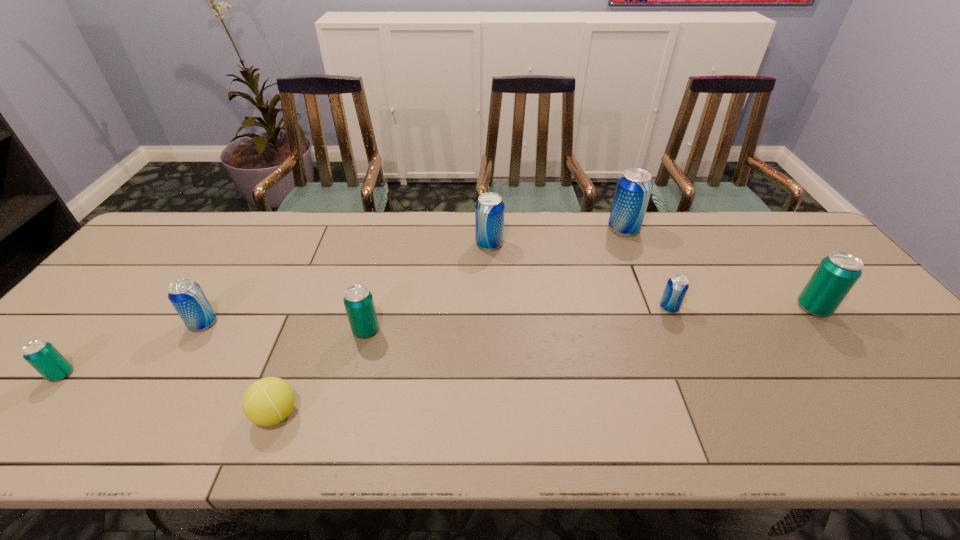
Where is `empty space that is in between the rightmost beer can and the sixth object from right to left`? empty space that is in between the rightmost beer can and the sixth object from right to left is located at coordinates (544, 361).

Locate an element on the screen. free space between the fourth object from right to left and the seventh object from right to left is located at coordinates (347, 284).

The width and height of the screenshot is (960, 540). I want to click on empty space that is in between the fourth object from left to right and the green tennis ball, so click(x=321, y=372).

Find the location of a particular element. This screenshot has height=540, width=960. vacant area that lies between the green tennis ball and the smallest blue beer can is located at coordinates (472, 361).

You are a GUI agent. You are given a task and a screenshot of the screen. Output one action in this format:
    pyautogui.click(x=<x>, y=<y>)
    Task: Click on the free spot between the leftmost beer can and the rightmost object
    The height and width of the screenshot is (540, 960).
    Given the screenshot: What is the action you would take?
    pyautogui.click(x=438, y=341)

Image resolution: width=960 pixels, height=540 pixels. Find the location of `free space between the tallest beer can and the second object from left to right`. free space between the tallest beer can and the second object from left to right is located at coordinates (413, 276).

Locate an element on the screen. The height and width of the screenshot is (540, 960). free space between the green tennis ball and the sixth beer can from right to left is located at coordinates tap(240, 369).

Locate an element on the screen. The height and width of the screenshot is (540, 960). free space between the smallest blue beer can and the third biggest blue beer can is located at coordinates (436, 315).

I want to click on object that is the sixth closest to the fifth beer can from right to left, so click(x=633, y=190).

Select which object appears as the fifth closest to the tennis ball. Please provide its 2D coordinates. Your answer should be formatted as a tuple, i.e. [(x, y)], where the tuple contains the x and y coordinates of a point satisfying the conditions above.

[(677, 286)]